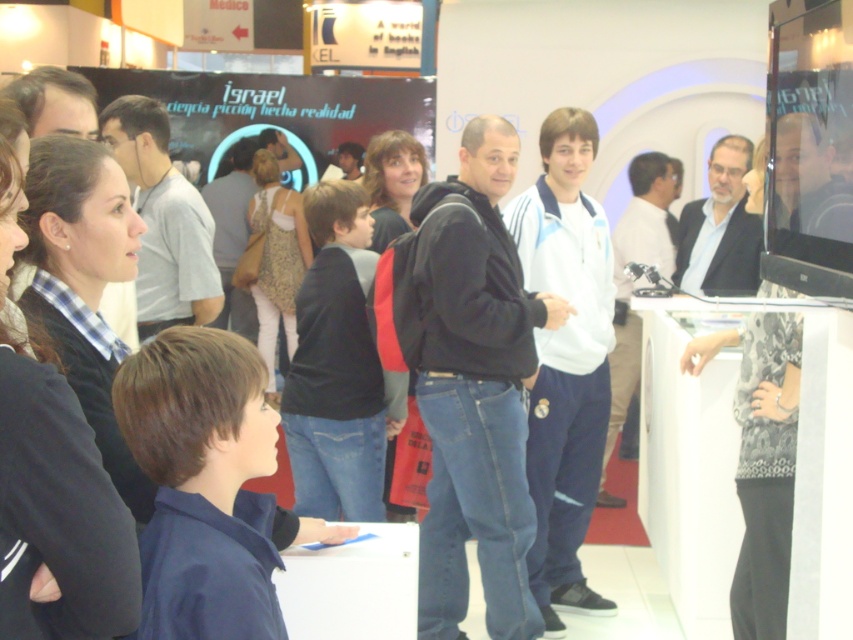
Does matte black suit at upper right have a lesser height compared to light blue jeans at center?

Correct, matte black suit at upper right is not as tall as light blue jeans at center.

Who is more forward, (751,145) or (619,337)?

Positioned in front is point (751,145).

Does point (741, 170) come in front of point (666, 186)?

Yes, point (741, 170) is in front of point (666, 186).

This screenshot has height=640, width=853. I want to click on matte black suit at upper right, so click(x=720, y=228).

Does white fleece jacket at center appear on the right side of light brown leather jacket at center?

Correct, you'll find white fleece jacket at center to the right of light brown leather jacket at center.

Is point (566, 522) in front of point (228, 288)?

Yes, it is in front of point (228, 288).

Between point (584, 604) and point (223, 180), which one is positioned behind?

The point (223, 180) is behind.

Image resolution: width=853 pixels, height=640 pixels. Identify the location of white fleece jacket at center. (566, 360).

Is point (556, 433) in front of point (144, 198)?

No, it is behind (144, 198).

Locate an element on the screen. Image resolution: width=853 pixels, height=640 pixels. white fleece jacket at center is located at coordinates (566, 360).